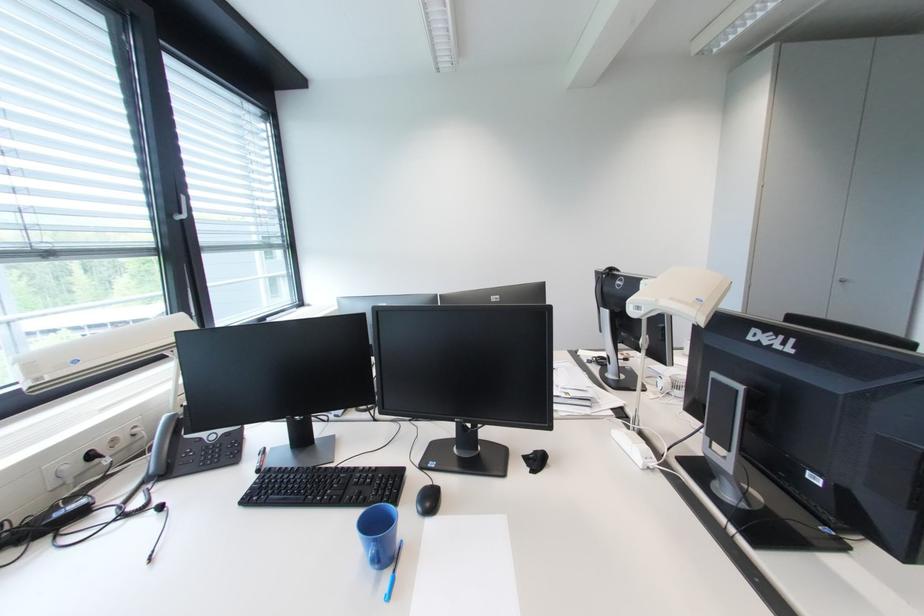
Find the location of a particular element. This screenshot has height=616, width=924. cabinet door handle is located at coordinates (845, 282).